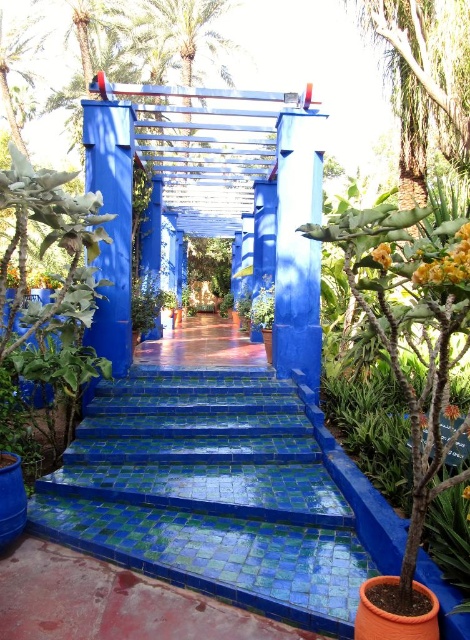
Question: Is blue mosaic tile stairs at center in front of green leafy palm tree at upper center?

Choices:
 (A) no
 (B) yes

Answer: (B)

Question: Considering the relative positions of blue mosaic tile stairs at center and green leafy palm tree at upper center in the image provided, where is blue mosaic tile stairs at center located with respect to green leafy palm tree at upper center?

Choices:
 (A) right
 (B) left

Answer: (A)

Question: Which point is farther from the camera taking this photo?

Choices:
 (A) (197, 3)
 (B) (242, 390)

Answer: (A)

Question: Which of the following is the closest to the observer?

Choices:
 (A) (101, 435)
 (B) (211, 13)

Answer: (A)

Question: Is blue mosaic tile stairs at center wider than green leafy palm tree at upper center?

Choices:
 (A) yes
 (B) no

Answer: (B)